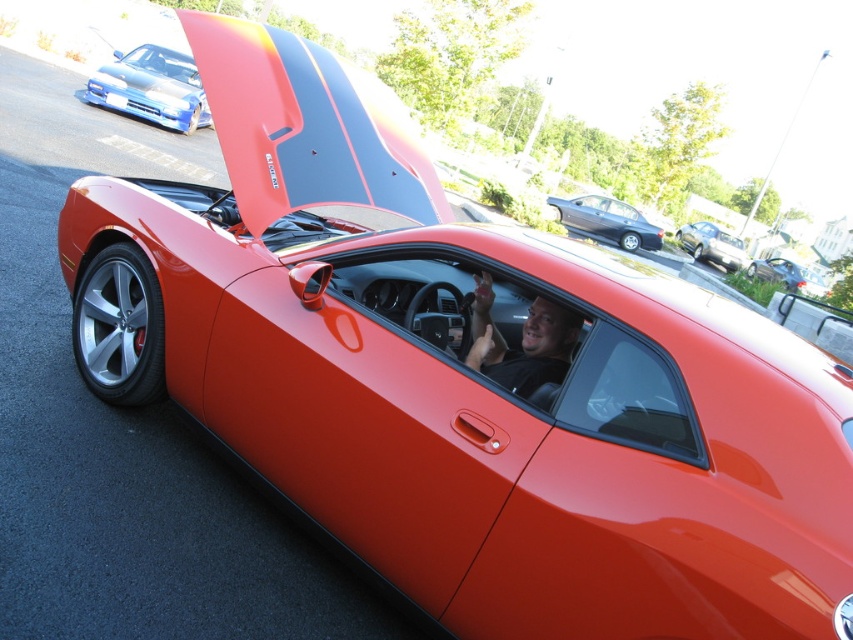
Consider the image. You are a photographer trying to capture a wide shot of the scene. You need to ensure that both the blue glossy sports car at upper left and the metallic gray sedan at center are fully visible in your frame. Given their heights, which car might require you to adjust your camera angle to avoid cropping its top?

The metallic gray sedan at center is taller than the blue glossy sports car at upper left, so you might need to adjust your camera angle to avoid cropping the top of the metallic gray sedan at center.

You are a parking attendant who needs to fit a new car into the parking spot between the blue glossy sports car at upper left and the metallic gray sedan at center. The new car is 1.8 meters wide. Can the new car fit in the space between them?

The blue glossy sports car at upper left has a lesser width compared to metallic gray sedan at center. Since the sports car is narrower, the space between them might accommodate the new car, but exact dimensions are needed for confirmation.

You are a delivery person trying to park your van between the shiny metallic hood at upper center and the blue glossy sports car at upper left. Can your van, which is 2 meters long, fit in the space between them?

The shiny metallic hood at upper center is shorter than the blue glossy sports car at upper left. Since the hood is shorter, the space between them might be narrower than 2 meters. Therefore, the van may not fit comfortably between the shiny metallic hood at upper center and the blue glossy sports car at upper left.